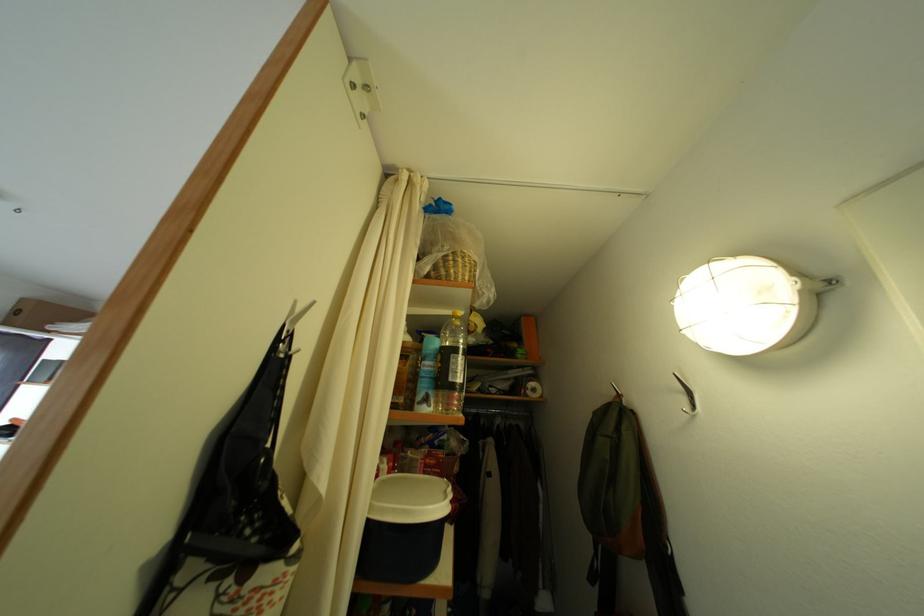
Where would you lift the clear plastic bottle? Please return your answer as a coordinate pair (x, y).

(452, 365)